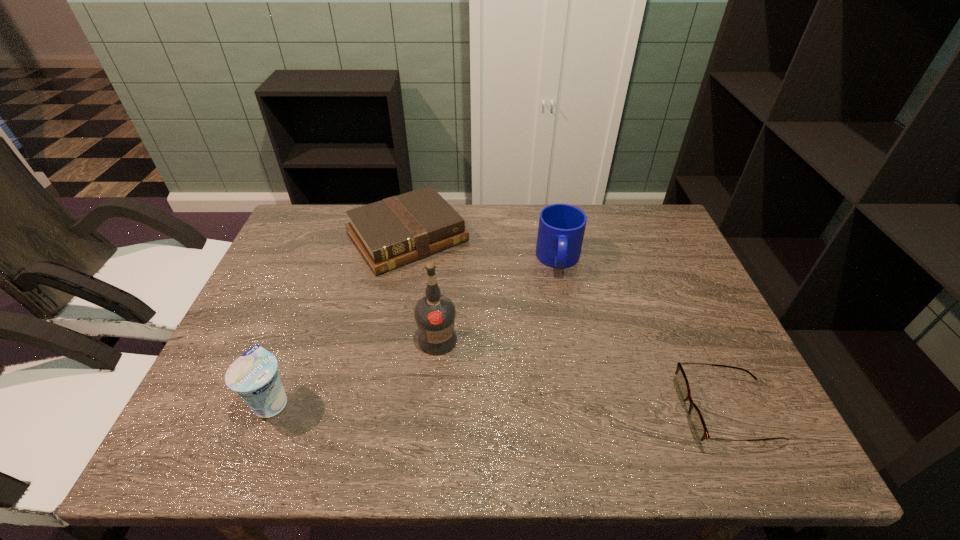
In the image, there is a desktop. At what (x,y) coordinates should I click in order to perform the action: click on free region at the left edge. Please return your answer as a coordinate pair (x, y). Looking at the image, I should click on (275, 329).

Locate an element on the screen. vacant space at the right edge of the desktop is located at coordinates (649, 300).

In the image, there is a desktop. Identify the location of free region at the far left corner. The height and width of the screenshot is (540, 960). (290, 233).

This screenshot has height=540, width=960. Identify the location of vacant space at the near left corner of the desktop. (223, 409).

The width and height of the screenshot is (960, 540). What are the coordinates of `vacant area between the mug and the shortest object` in the screenshot? It's located at (642, 336).

At what (x,y) coordinates should I click in order to perform the action: click on vacant area between the yogurt and the second object from right to left. Please return your answer as a coordinate pair (x, y). Looking at the image, I should click on pyautogui.click(x=416, y=330).

I want to click on unoccupied area between the fourth tallest object and the yogurt, so click(340, 319).

The image size is (960, 540). I want to click on vacant point located between the vodka and the Bible, so pos(422,288).

Find the location of a particular element. This screenshot has height=540, width=960. vacant area between the rightmost object and the second object from right to left is located at coordinates (642, 336).

The width and height of the screenshot is (960, 540). I want to click on free space that is in between the shortest object and the mug, so click(642, 336).